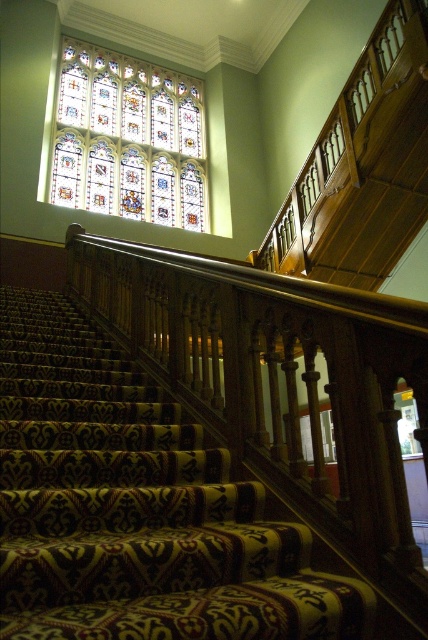
Does patterned carpet stairs at center appear under stained glass at upper left?

Yes, patterned carpet stairs at center is below stained glass at upper left.

Where is `patterned carpet stairs at center`? This screenshot has width=428, height=640. patterned carpet stairs at center is located at coordinates (134, 506).

Is point (92, 525) more distant than point (193, 124)?

No, it is in front of (193, 124).

Find the location of a particular element. patterned carpet stairs at center is located at coordinates (134, 506).